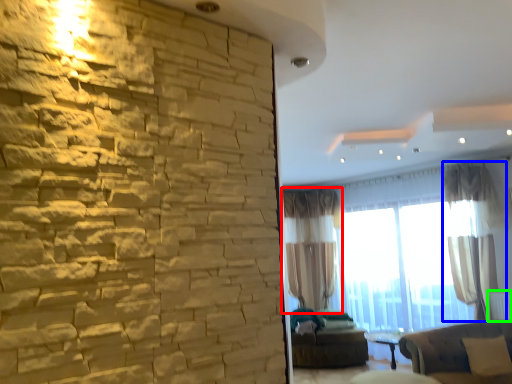
Question: Considering the real-world distances, which object is farthest from curtain (highlighted by a red box)? curtain (highlighted by a blue box) or radiator (highlighted by a green box)?

Choices:
 (A) curtain
 (B) radiator

Answer: (B)